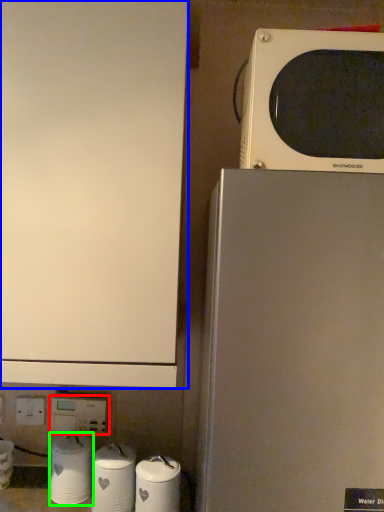
Question: Estimate the real-world distances between objects in this image. Which object is closer to electric outlet (highlighted by a red box), home appliance (highlighted by a blue box) or appliance (highlighted by a green box)?

Choices:
 (A) home appliance
 (B) appliance

Answer: (B)